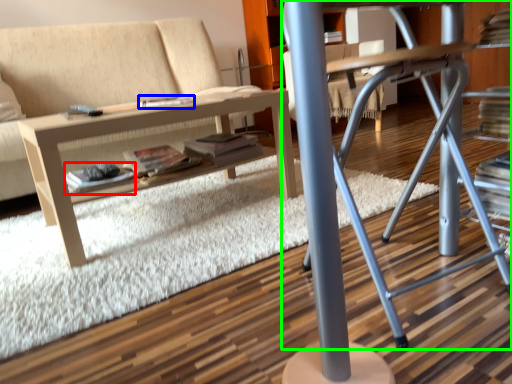
Question: Based on their relative distances, which object is farther from paperback book (highlighted by a red box)? Choose from magazine (highlighted by a blue box) and computer desk (highlighted by a green box).

Choices:
 (A) magazine
 (B) computer desk

Answer: (B)